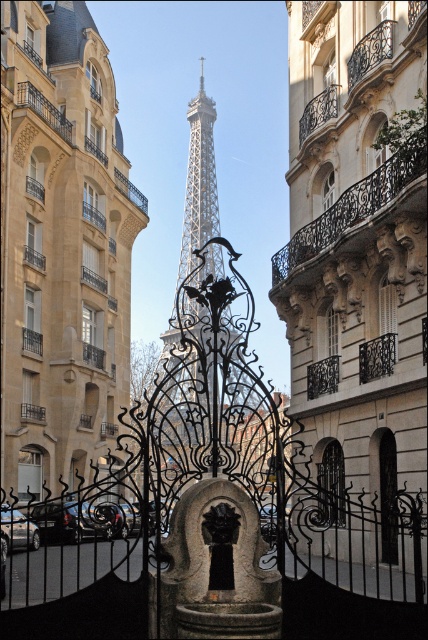
Question: Which point is farther to the camera?

Choices:
 (A) black wrought iron gate at center
 (B) white metallic eiffel tower at center

Answer: (B)

Question: Which of the following is the closest to the observer?

Choices:
 (A) (133, 637)
 (B) (204, 237)
 (C) (68, 461)

Answer: (A)

Question: Is black wrought iron gate at center smaller than white metallic eiffel tower at center?

Choices:
 (A) no
 (B) yes

Answer: (B)

Question: Considering the relative positions of smooth stone tower at center and white metallic eiffel tower at center in the image provided, where is smooth stone tower at center located with respect to white metallic eiffel tower at center?

Choices:
 (A) below
 (B) above

Answer: (A)

Question: Which of the following is the farthest from the observer?

Choices:
 (A) smooth stone tower at center
 (B) white metallic eiffel tower at center
 (C) black wrought iron gate at center

Answer: (B)

Question: Does smooth stone tower at center have a larger size compared to white metallic eiffel tower at center?

Choices:
 (A) yes
 (B) no

Answer: (B)